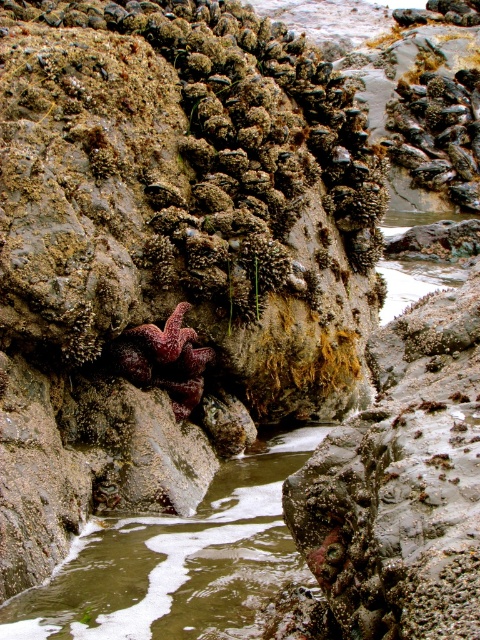
Question: Does greenish water at center appear under red matte starfish at center?

Choices:
 (A) no
 (B) yes

Answer: (B)

Question: Does greenish water at center come in front of red matte starfish at center?

Choices:
 (A) yes
 (B) no

Answer: (A)

Question: Which of the following is the closest to the observer?

Choices:
 (A) (171, 323)
 (B) (279, 560)

Answer: (B)

Question: Is greenish water at center above red matte starfish at center?

Choices:
 (A) yes
 (B) no

Answer: (B)

Question: Which point is farther from the camera taking this photo?

Choices:
 (A) (172, 342)
 (B) (78, 544)

Answer: (A)

Question: Which point appears farthest from the camera in this image?

Choices:
 (A) (124, 353)
 (B) (196, 577)

Answer: (A)